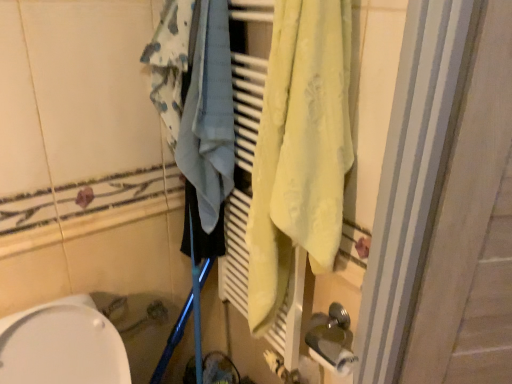
Question: Is white matte toilet paper at lower right to the left of light blue fabric at center from the viewer's perspective?

Choices:
 (A) yes
 (B) no

Answer: (B)

Question: Considering the relative positions of white matte toilet paper at lower right and light blue fabric at center in the image provided, is white matte toilet paper at lower right in front of light blue fabric at center?

Choices:
 (A) no
 (B) yes

Answer: (A)

Question: Is white matte toilet paper at lower right aimed at light blue fabric at center?

Choices:
 (A) yes
 (B) no

Answer: (B)

Question: From the image's perspective, is white matte toilet paper at lower right below light blue fabric at center?

Choices:
 (A) yes
 (B) no

Answer: (A)

Question: Considering the relative sizes of white matte toilet paper at lower right and light blue fabric at center in the image provided, is white matte toilet paper at lower right shorter than light blue fabric at center?

Choices:
 (A) no
 (B) yes

Answer: (B)

Question: From a real-world perspective, is white matte toilet paper at lower right physically above light blue fabric at center?

Choices:
 (A) no
 (B) yes

Answer: (A)

Question: Is white matte toilet paper at lower right wider than white glossy toilet at lower left?

Choices:
 (A) yes
 (B) no

Answer: (B)

Question: Is white matte toilet paper at lower right outside of white glossy toilet at lower left?

Choices:
 (A) no
 (B) yes

Answer: (B)

Question: Is white matte toilet paper at lower right not close to white glossy toilet at lower left?

Choices:
 (A) yes
 (B) no

Answer: (B)

Question: Is the surface of white matte toilet paper at lower right in direct contact with white glossy toilet at lower left?

Choices:
 (A) yes
 (B) no

Answer: (B)

Question: Does white matte toilet paper at lower right appear on the left side of white glossy toilet at lower left?

Choices:
 (A) yes
 (B) no

Answer: (B)

Question: Is white matte toilet paper at lower right behind white glossy toilet at lower left?

Choices:
 (A) yes
 (B) no

Answer: (A)

Question: Does light blue fabric at center come in front of white matte toilet paper at lower right?

Choices:
 (A) yes
 (B) no

Answer: (A)